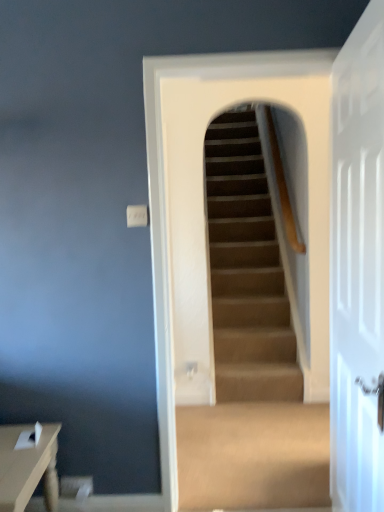
Question: From a real-world perspective, is carpeted stairs at center over matte brown table at lower left?

Choices:
 (A) no
 (B) yes

Answer: (B)

Question: Is carpeted stairs at center taller than matte brown table at lower left?

Choices:
 (A) yes
 (B) no

Answer: (A)

Question: Can you confirm if carpeted stairs at center is shorter than matte brown table at lower left?

Choices:
 (A) yes
 (B) no

Answer: (B)

Question: Does carpeted stairs at center have a smaller size compared to matte brown table at lower left?

Choices:
 (A) yes
 (B) no

Answer: (B)

Question: From a real-world perspective, is carpeted stairs at center beneath matte brown table at lower left?

Choices:
 (A) no
 (B) yes

Answer: (A)

Question: Is carpeted stairs at center wider than matte brown table at lower left?

Choices:
 (A) no
 (B) yes

Answer: (A)

Question: Is carpeted stairs at center in contact with white glossy door at right?

Choices:
 (A) yes
 (B) no

Answer: (B)

Question: Is carpeted stairs at center facing towards white glossy door at right?

Choices:
 (A) yes
 (B) no

Answer: (A)

Question: Is carpeted stairs at center facing away from white glossy door at right?

Choices:
 (A) no
 (B) yes

Answer: (A)

Question: Is carpeted stairs at center closer to camera compared to white glossy door at right?

Choices:
 (A) no
 (B) yes

Answer: (A)

Question: Can you confirm if carpeted stairs at center is smaller than white glossy door at right?

Choices:
 (A) yes
 (B) no

Answer: (B)

Question: From a real-world perspective, is carpeted stairs at center physically below white glossy door at right?

Choices:
 (A) no
 (B) yes

Answer: (A)

Question: From the image's perspective, is white glossy door at right on top of matte brown table at lower left?

Choices:
 (A) no
 (B) yes

Answer: (B)